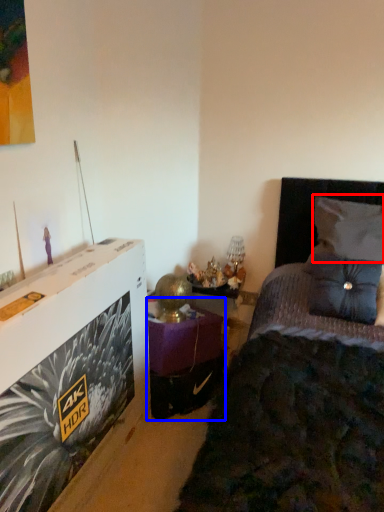
Question: Among these objects, which one is farthest to the camera, pillow (highlighted by a red box) or table (highlighted by a blue box)?

Choices:
 (A) pillow
 (B) table

Answer: (B)